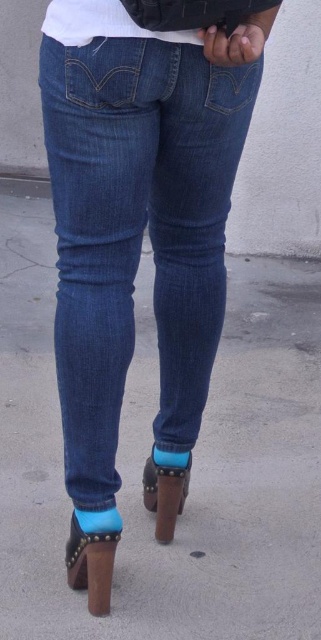
Question: Which point is closer to the camera?

Choices:
 (A) denim at center
 (B) white matte shirt at upper center
 (C) leather/cowhide high-heeled sandal at lower center
 (D) brown leather sandal at lower center

Answer: (B)

Question: Which of the following is the farthest from the observer?

Choices:
 (A) white matte shirt at upper center
 (B) denim at center
 (C) brown leather sandal at lower center
 (D) leather/cowhide high-heeled sandal at lower center

Answer: (C)

Question: Does denim at center appear under leather/cowhide high-heeled sandal at lower center?

Choices:
 (A) yes
 (B) no

Answer: (B)

Question: Does denim at center have a smaller size compared to brown leather sandal at lower center?

Choices:
 (A) yes
 (B) no

Answer: (B)

Question: Where is denim at center located in relation to brown leather sandal at lower center in the image?

Choices:
 (A) left
 (B) right

Answer: (A)

Question: Among these points, which one is farthest from the camera?

Choices:
 (A) (x=59, y=86)
 (B) (x=161, y=544)

Answer: (B)